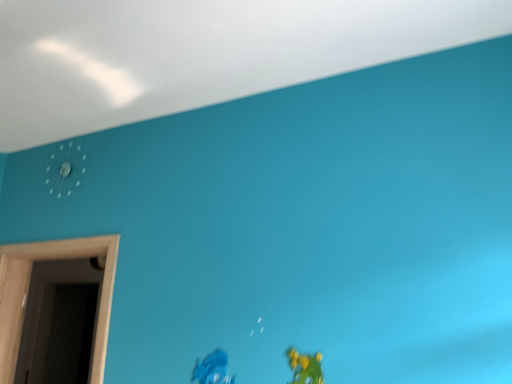
Question: Does matte blue toy at lower center, the 2th toy when ordered from right to left, have a greater height compared to white plastic clock at upper left?

Choices:
 (A) yes
 (B) no

Answer: (B)

Question: From the image's perspective, is matte blue toy at lower center, which ranks as the first toy in back-to-front order, on top of white plastic clock at upper left?

Choices:
 (A) no
 (B) yes

Answer: (A)

Question: Considering the relative sizes of matte blue toy at lower center, arranged as the second toy when viewed from the front, and white plastic clock at upper left in the image provided, is matte blue toy at lower center, arranged as the second toy when viewed from the front, bigger than white plastic clock at upper left?

Choices:
 (A) yes
 (B) no

Answer: (B)

Question: Is matte blue toy at lower center, arranged as the second toy when viewed from the front, thinner than white plastic clock at upper left?

Choices:
 (A) yes
 (B) no

Answer: (A)

Question: Are matte blue toy at lower center, arranged as the second toy when viewed from the front, and white plastic clock at upper left making contact?

Choices:
 (A) yes
 (B) no

Answer: (B)

Question: Could white plastic clock at upper left be considered to be inside matte blue toy at lower center, the 2th toy when ordered from right to left?

Choices:
 (A) yes
 (B) no

Answer: (B)

Question: Is wooden door at left at the left side of white plastic clock at upper left?

Choices:
 (A) yes
 (B) no

Answer: (B)

Question: Is wooden door at left wider than white plastic clock at upper left?

Choices:
 (A) no
 (B) yes

Answer: (B)

Question: Considering the relative sizes of wooden door at left and white plastic clock at upper left in the image provided, is wooden door at left taller than white plastic clock at upper left?

Choices:
 (A) no
 (B) yes

Answer: (B)

Question: Can you confirm if wooden door at left is thinner than white plastic clock at upper left?

Choices:
 (A) yes
 (B) no

Answer: (B)

Question: Is wooden door at left not within white plastic clock at upper left?

Choices:
 (A) no
 (B) yes

Answer: (B)

Question: Is wooden door at left facing away from white plastic clock at upper left?

Choices:
 (A) yes
 (B) no

Answer: (B)

Question: Is white plastic clock at upper left taller than matte green toy at lower right, which is counted as the first toy, starting from the right?

Choices:
 (A) no
 (B) yes

Answer: (B)